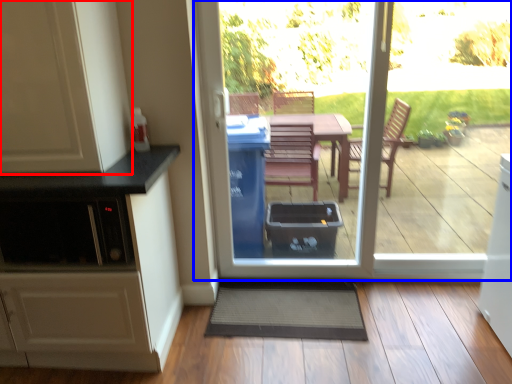
Question: Among these objects, which one is nearest to the camera, cabinetry (highlighted by a red box) or door (highlighted by a blue box)?

Choices:
 (A) cabinetry
 (B) door

Answer: (A)